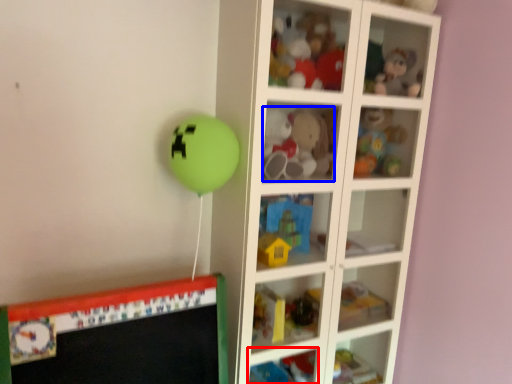
Question: Which point is further to the camera, cabinet (highlighted by a red box) or toy (highlighted by a blue box)?

Choices:
 (A) cabinet
 (B) toy

Answer: (A)